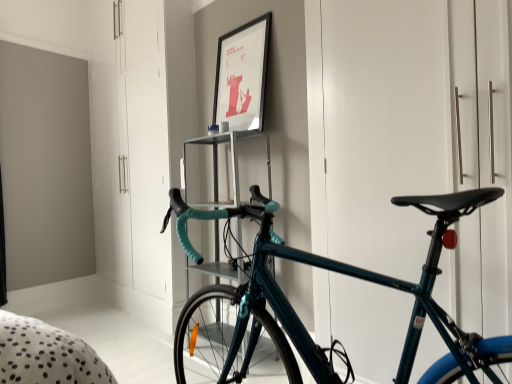
Question: Does teal glossy bicycle at center touch teal glossy bicycle at right?

Choices:
 (A) no
 (B) yes

Answer: (A)

Question: Would you consider teal glossy bicycle at center to be distant from teal glossy bicycle at right?

Choices:
 (A) no
 (B) yes

Answer: (A)

Question: Considering the relative positions of teal glossy bicycle at center and teal glossy bicycle at right in the image provided, is teal glossy bicycle at center behind teal glossy bicycle at right?

Choices:
 (A) no
 (B) yes

Answer: (A)

Question: From a real-world perspective, is teal glossy bicycle at center positioned over teal glossy bicycle at right based on gravity?

Choices:
 (A) yes
 (B) no

Answer: (B)

Question: From the image's perspective, does teal glossy bicycle at center appear higher than teal glossy bicycle at right?

Choices:
 (A) no
 (B) yes

Answer: (A)

Question: From the image's perspective, would you say teal glossy bicycle at center is shown under teal glossy bicycle at right?

Choices:
 (A) yes
 (B) no

Answer: (A)

Question: From the image's perspective, does teal glossy bicycle at right appear lower than metallic silver shelf at center?

Choices:
 (A) no
 (B) yes

Answer: (A)

Question: Is metallic silver shelf at center at the back of teal glossy bicycle at right?

Choices:
 (A) no
 (B) yes

Answer: (A)

Question: Does teal glossy bicycle at right appear on the right side of metallic silver shelf at center?

Choices:
 (A) yes
 (B) no

Answer: (A)

Question: Does teal glossy bicycle at right touch metallic silver shelf at center?

Choices:
 (A) no
 (B) yes

Answer: (A)

Question: Considering the relative sizes of teal glossy bicycle at right and metallic silver shelf at center in the image provided, is teal glossy bicycle at right taller than metallic silver shelf at center?

Choices:
 (A) no
 (B) yes

Answer: (B)

Question: From a real-world perspective, is teal glossy bicycle at right under metallic silver shelf at center?

Choices:
 (A) yes
 (B) no

Answer: (B)

Question: Is teal glossy bicycle at right located within metallic silver shelf at center?

Choices:
 (A) yes
 (B) no

Answer: (B)